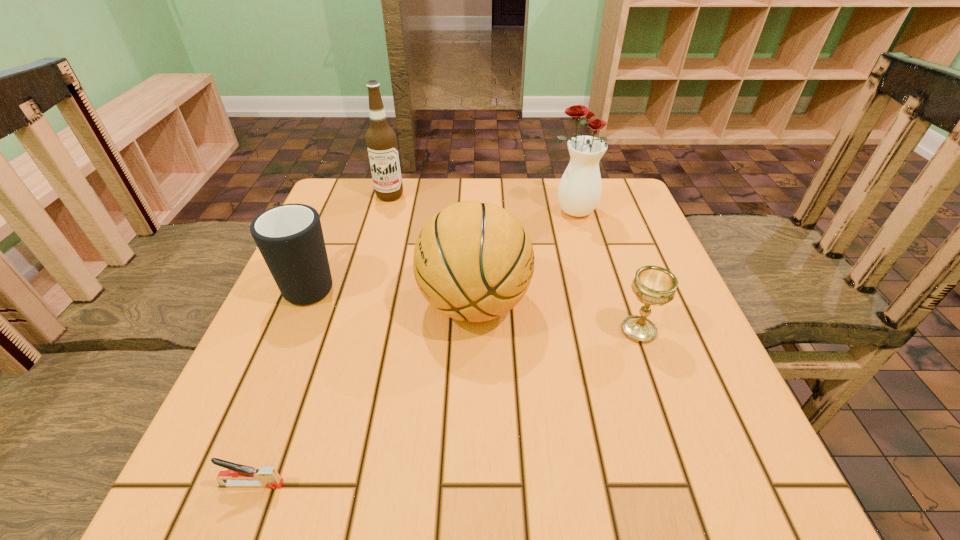
The width and height of the screenshot is (960, 540). What are the coordinates of `alcohol` in the screenshot? It's located at (381, 140).

Find the location of `vase`. vase is located at coordinates (579, 192).

I want to click on basketball, so click(x=474, y=261).

Where is `the third object from right to left`? The height and width of the screenshot is (540, 960). the third object from right to left is located at coordinates (474, 261).

The height and width of the screenshot is (540, 960). I want to click on the third shortest object, so click(289, 237).

You are a GUI agent. You are given a task and a screenshot of the screen. Output one action in this format:
    pyautogui.click(x=<x>, y=<y>)
    Task: Click on the fifth tallest object
    This screenshot has width=960, height=540.
    Given the screenshot: What is the action you would take?
    pyautogui.click(x=653, y=285)

Locate an element on the screen. The width and height of the screenshot is (960, 540). the shortest object is located at coordinates (238, 475).

This screenshot has width=960, height=540. Identify the location of the nearest object. (238, 475).

I want to click on free space located on the label of the alcohol, so click(x=370, y=267).

Locate an element on the screen. free spot located 0.270m on the left of the vase is located at coordinates (443, 211).